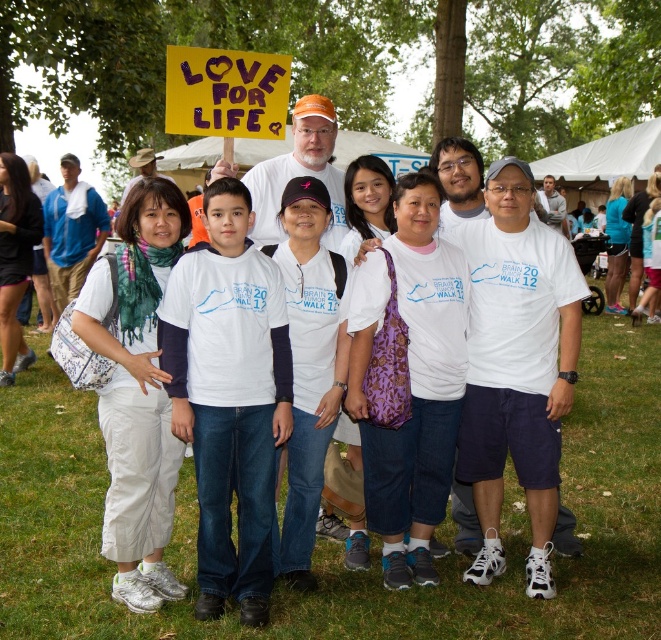
Question: Is white long-sleeved shirt at center thinner than yellow paper sign at upper center?

Choices:
 (A) no
 (B) yes

Answer: (B)

Question: Which of the following is the closest to the observer?

Choices:
 (A) white long-sleeved shirt at center
 (B) yellow paper sign at upper center

Answer: (A)

Question: Is white long-sleeved shirt at center positioned at the back of yellow paper sign at upper center?

Choices:
 (A) yes
 (B) no

Answer: (B)

Question: Can you confirm if white long-sleeved shirt at center is wider than yellow paper sign at upper center?

Choices:
 (A) yes
 (B) no

Answer: (B)

Question: Which point is closer to the camera?

Choices:
 (A) yellow paper sign at upper center
 (B) white long-sleeved shirt at center

Answer: (B)